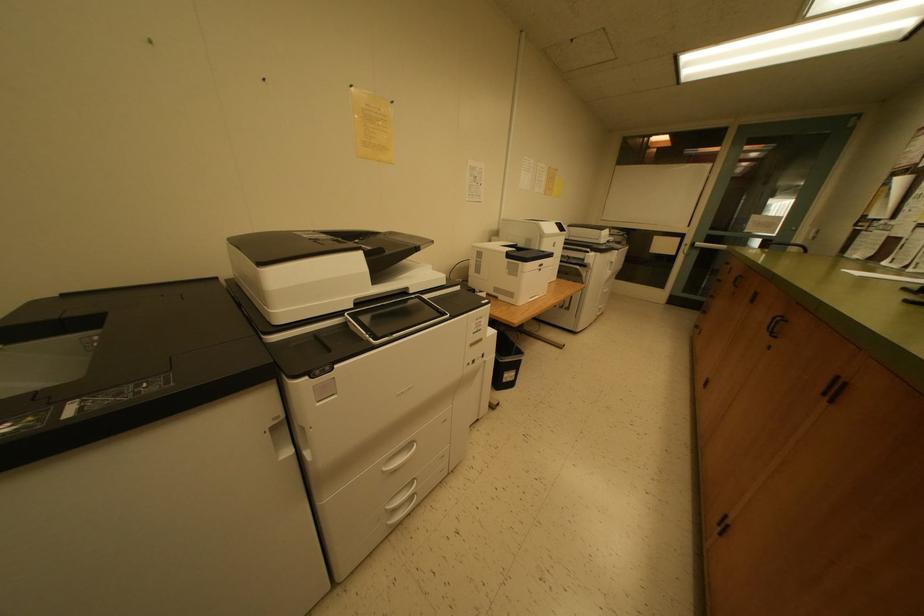
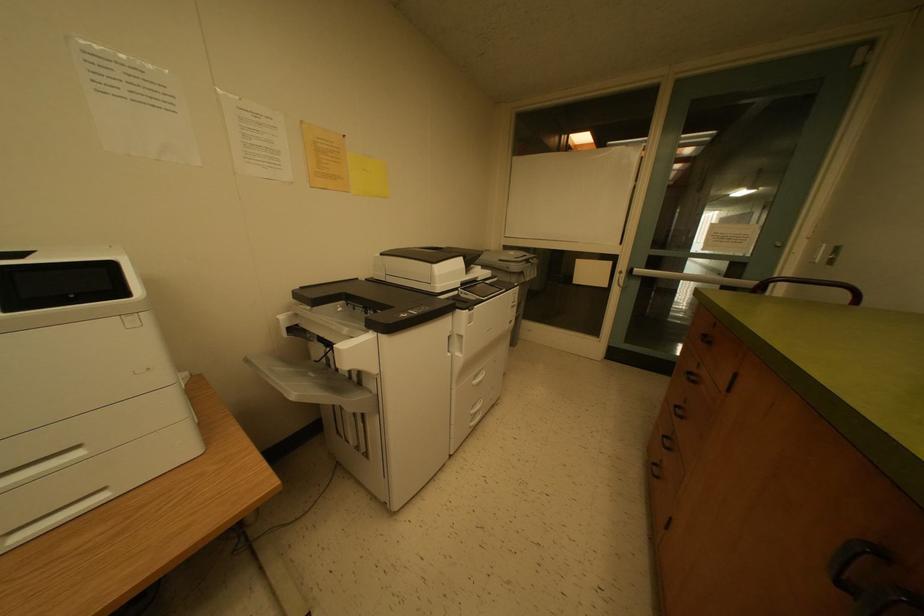
Which direction would the cameraman need to move to produce the second image?

The cameraman moved toward right, forward.